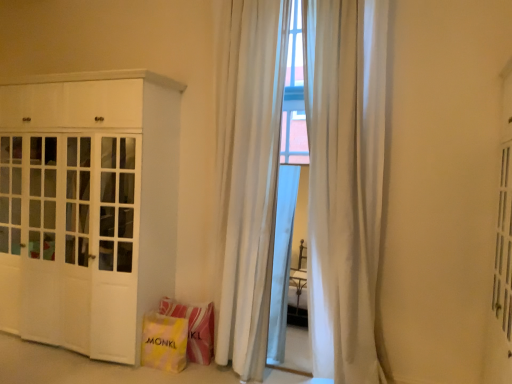
The height and width of the screenshot is (384, 512). I want to click on yellow fabric shopping bag at lower center, which appears as the second shopping bag when viewed from the front, so click(x=194, y=327).

Image resolution: width=512 pixels, height=384 pixels. What do you see at coordinates (88, 207) in the screenshot?
I see `white matte cabinet at left` at bounding box center [88, 207].

Find the location of `yellow fabric shopping bag at lower left, placed as the 1th shopping bag when sorted from front to back`. yellow fabric shopping bag at lower left, placed as the 1th shopping bag when sorted from front to back is located at coordinates (164, 342).

The height and width of the screenshot is (384, 512). What do you see at coordinates (164, 342) in the screenshot? I see `yellow fabric shopping bag at lower left, placed as the 1th shopping bag when sorted from front to back` at bounding box center [164, 342].

Locate an element on the screen. white sheer curtain at center, the 1th curtain viewed from the right is located at coordinates (345, 180).

Looking at the image, does yellow fabric shopping bag at lower center, the 1th shopping bag from the back, seem bigger or smaller compared to white sheer curtain at center, the 1th curtain viewed from the right?

Considering their sizes, yellow fabric shopping bag at lower center, the 1th shopping bag from the back, takes up less space than white sheer curtain at center, the 1th curtain viewed from the right.

Is yellow fabric shopping bag at lower center, which appears as the second shopping bag when viewed from the front, not near white sheer curtain at center, the 2th curtain positioned from the left?

Yes, yellow fabric shopping bag at lower center, which appears as the second shopping bag when viewed from the front, and white sheer curtain at center, the 2th curtain positioned from the left, are quite far apart.

Where is `shopping bag that is the 1st one when counting leftward from the white sheer curtain at center, the 1th curtain viewed from the right`? Image resolution: width=512 pixels, height=384 pixels. shopping bag that is the 1st one when counting leftward from the white sheer curtain at center, the 1th curtain viewed from the right is located at coordinates (194, 327).

What's the angular difference between yellow fabric shopping bag at lower center, which appears as the second shopping bag when viewed from the front, and white sheer curtain at center, the 2th curtain positioned from the left,'s facing directions?

There is a 1.24-degree angle between the facing directions of yellow fabric shopping bag at lower center, which appears as the second shopping bag when viewed from the front, and white sheer curtain at center, the 2th curtain positioned from the left.

Is point (331, 34) closer to viewer compared to point (26, 181)?

Yes, it is in front of point (26, 181).

From the image's perspective, which one is positioned lower, white sheer curtain at center, the 1th curtain viewed from the right, or white matte cabinet at left?

white matte cabinet at left is shown below in the image.

How far apart are white sheer curtain at center, the 1th curtain viewed from the right, and white matte cabinet at left?

A distance of 5.52 feet exists between white sheer curtain at center, the 1th curtain viewed from the right, and white matte cabinet at left.

Is white sheer curtain at center, the 1th curtain viewed from the right, next to white matte cabinet at left and touching it?

white sheer curtain at center, the 1th curtain viewed from the right, and white matte cabinet at left are not in contact.

Is white matte cabinet at left oriented away from white sheer curtain at center, placed as the second curtain when sorted from right to left?

white matte cabinet at left does not have its back to white sheer curtain at center, placed as the second curtain when sorted from right to left.

From a real-world perspective, does white matte cabinet at left sit lower than white sheer curtain at center, which is the first curtain from left to right?

Yes, from a real-world perspective, white matte cabinet at left is under white sheer curtain at center, which is the first curtain from left to right.

Would you say white matte cabinet at left is a long distance from white sheer curtain at center, which is the first curtain from left to right?

white matte cabinet at left is actually quite close to white sheer curtain at center, which is the first curtain from left to right.

Who is taller, yellow fabric shopping bag at lower left, placed as the 1th shopping bag when sorted from front to back, or yellow fabric shopping bag at lower center, which appears as the second shopping bag when viewed from the front?

yellow fabric shopping bag at lower center, which appears as the second shopping bag when viewed from the front, is taller.

Would you say yellow fabric shopping bag at lower left, positioned as the 2th shopping bag in back-to-front order, is to the left or to the right of yellow fabric shopping bag at lower center, the 1th shopping bag from the back, in the picture?

Clearly, yellow fabric shopping bag at lower left, positioned as the 2th shopping bag in back-to-front order, is on the left of yellow fabric shopping bag at lower center, the 1th shopping bag from the back, in the image.

Is yellow fabric shopping bag at lower left, placed as the 1th shopping bag when sorted from front to back, situated inside yellow fabric shopping bag at lower center, which appears as the second shopping bag when viewed from the front, or outside?

yellow fabric shopping bag at lower left, placed as the 1th shopping bag when sorted from front to back, is not inside yellow fabric shopping bag at lower center, which appears as the second shopping bag when viewed from the front, it's outside.

Is yellow fabric shopping bag at lower left, positioned as the 2th shopping bag in back-to-front order, positioned with its back to yellow fabric shopping bag at lower center, the 1th shopping bag from the back?

Yes, yellow fabric shopping bag at lower left, positioned as the 2th shopping bag in back-to-front order, is positioned with its back facing yellow fabric shopping bag at lower center, the 1th shopping bag from the back.

Is yellow fabric shopping bag at lower left, positioned as the 2th shopping bag in back-to-front order, located within white sheer curtain at center, placed as the second curtain when sorted from right to left?

Answer: No, yellow fabric shopping bag at lower left, positioned as the 2th shopping bag in back-to-front order, is not a part of white sheer curtain at center, placed as the second curtain when sorted from right to left.

Could you measure the distance between white sheer curtain at center, which is the first curtain from left to right, and yellow fabric shopping bag at lower left, placed as the 1th shopping bag when sorted from front to back?

white sheer curtain at center, which is the first curtain from left to right, is 32.48 inches from yellow fabric shopping bag at lower left, placed as the 1th shopping bag when sorted from front to back.

Which is closer, (220, 265) or (170, 330)?

Positioned in front is point (170, 330).

You are a GUI agent. You are given a task and a screenshot of the screen. Output one action in this format:
    pyautogui.click(x=<x>, y=<y>)
    Task: Click on the 2nd curtain directly above the yellow fabric shopping bag at lower center, which appears as the second shopping bag when viewed from the front (from a real-world perspective)
    This screenshot has width=512, height=384.
    Given the screenshot: What is the action you would take?
    pyautogui.click(x=345, y=180)

Considering the sizes of objects white sheer curtain at center, the 1th curtain viewed from the right, and yellow fabric shopping bag at lower center, the 1th shopping bag from the back, in the image provided, who is bigger, white sheer curtain at center, the 1th curtain viewed from the right, or yellow fabric shopping bag at lower center, the 1th shopping bag from the back,?

Bigger between the two is white sheer curtain at center, the 1th curtain viewed from the right.

Is white sheer curtain at center, the 1th curtain viewed from the right, wider or thinner than yellow fabric shopping bag at lower center, which appears as the second shopping bag when viewed from the front?

Considering their sizes, white sheer curtain at center, the 1th curtain viewed from the right, looks slimmer than yellow fabric shopping bag at lower center, which appears as the second shopping bag when viewed from the front.

Based on the photo, does yellow fabric shopping bag at lower left, placed as the 1th shopping bag when sorted from front to back, come behind white sheer curtain at center, which is the first curtain from left to right?

Yes, yellow fabric shopping bag at lower left, placed as the 1th shopping bag when sorted from front to back, is behind white sheer curtain at center, which is the first curtain from left to right.

Between yellow fabric shopping bag at lower left, positioned as the 2th shopping bag in back-to-front order, and white sheer curtain at center, placed as the second curtain when sorted from right to left, which one has more height?

With more height is white sheer curtain at center, placed as the second curtain when sorted from right to left.

Would you say yellow fabric shopping bag at lower left, placed as the 1th shopping bag when sorted from front to back, is inside or outside white sheer curtain at center, which is the first curtain from left to right?

yellow fabric shopping bag at lower left, placed as the 1th shopping bag when sorted from front to back, lies outside white sheer curtain at center, which is the first curtain from left to right.

Is yellow fabric shopping bag at lower left, placed as the 1th shopping bag when sorted from front to back, facing away from white sheer curtain at center, placed as the second curtain when sorted from right to left?

yellow fabric shopping bag at lower left, placed as the 1th shopping bag when sorted from front to back, is not turned away from white sheer curtain at center, placed as the second curtain when sorted from right to left.

From a real-world perspective, count 1st shopping bags downward from the white sheer curtain at center, the 1th curtain viewed from the right, and point to it. Please provide its 2D coordinates.

[(194, 327)]

I want to click on the 1st curtain above the white matte cabinet at left (from the image's perspective), so click(x=345, y=180).

Considering their positions, is white matte cabinet at left positioned further to white sheer curtain at center, placed as the second curtain when sorted from right to left, than yellow fabric shopping bag at lower center, the 1th shopping bag from the back?

white matte cabinet at left.

Estimate the real-world distances between objects in this image. Which object is further from yellow fabric shopping bag at lower center, which appears as the second shopping bag when viewed from the front, white sheer curtain at center, the 2th curtain positioned from the left, or white sheer curtain at center, placed as the second curtain when sorted from right to left?

white sheer curtain at center, the 2th curtain positioned from the left.

When comparing their distances from white sheer curtain at center, placed as the second curtain when sorted from right to left, does white matte cabinet at left or yellow fabric shopping bag at lower left, positioned as the 2th shopping bag in back-to-front order, seem further?

white matte cabinet at left.

From the image, which object appears to be farther from white sheer curtain at center, the 1th curtain viewed from the right, white matte cabinet at left or white sheer curtain at center, placed as the second curtain when sorted from right to left?

Based on the image, white matte cabinet at left appears to be further to white sheer curtain at center, the 1th curtain viewed from the right.

When comparing their distances from yellow fabric shopping bag at lower center, the 1th shopping bag from the back, does white sheer curtain at center, placed as the second curtain when sorted from right to left, or white matte cabinet at left seem closer?

white sheer curtain at center, placed as the second curtain when sorted from right to left, is positioned closer to the anchor yellow fabric shopping bag at lower center, the 1th shopping bag from the back.

Estimate the real-world distances between objects in this image. Which object is further from white matte cabinet at left, yellow fabric shopping bag at lower left, positioned as the 2th shopping bag in back-to-front order, or yellow fabric shopping bag at lower center, the 1th shopping bag from the back?

yellow fabric shopping bag at lower center, the 1th shopping bag from the back, is positioned further to the anchor white matte cabinet at left.

Considering their positions, is white sheer curtain at center, placed as the second curtain when sorted from right to left, positioned closer to white matte cabinet at left than white sheer curtain at center, the 1th curtain viewed from the right?

white sheer curtain at center, placed as the second curtain when sorted from right to left, is closer to white matte cabinet at left.

From the image, which object appears to be nearer to yellow fabric shopping bag at lower left, positioned as the 2th shopping bag in back-to-front order, yellow fabric shopping bag at lower center, which appears as the second shopping bag when viewed from the front, or white matte cabinet at left?

yellow fabric shopping bag at lower center, which appears as the second shopping bag when viewed from the front.

Locate an element on the screen. The width and height of the screenshot is (512, 384). curtain between white sheer curtain at center, which is the first curtain from left to right, and yellow fabric shopping bag at lower center, the 1th shopping bag from the back, vertically is located at coordinates (345, 180).

Image resolution: width=512 pixels, height=384 pixels. In order to click on shopping bag between white sheer curtain at center, the 1th curtain viewed from the right, and yellow fabric shopping bag at lower left, placed as the 1th shopping bag when sorted from front to back, from top to bottom in this screenshot , I will do `click(194, 327)`.

Where is `shopping bag that lies between white sheer curtain at center, placed as the second curtain when sorted from right to left, and yellow fabric shopping bag at lower left, placed as the 1th shopping bag when sorted from front to back, from top to bottom`? Image resolution: width=512 pixels, height=384 pixels. shopping bag that lies between white sheer curtain at center, placed as the second curtain when sorted from right to left, and yellow fabric shopping bag at lower left, placed as the 1th shopping bag when sorted from front to back, from top to bottom is located at coordinates (194, 327).

Find the location of a particular element. This screenshot has width=512, height=384. curtain between white sheer curtain at center, which is the first curtain from left to right, and yellow fabric shopping bag at lower left, placed as the 1th shopping bag when sorted from front to back, in the vertical direction is located at coordinates (345, 180).